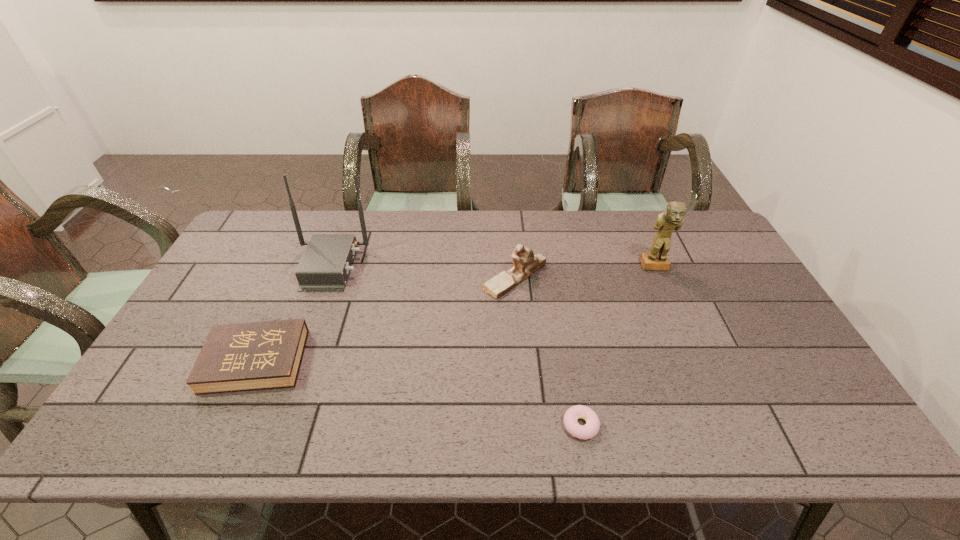
Image resolution: width=960 pixels, height=540 pixels. I want to click on vacant point located between the left figurine and the router, so click(422, 272).

You are a GUI agent. You are given a task and a screenshot of the screen. Output one action in this format:
    pyautogui.click(x=<x>, y=<y>)
    Task: Click on the vacant point located between the second shortest object and the right figurine
    The image size is (960, 540).
    Given the screenshot: What is the action you would take?
    pyautogui.click(x=455, y=314)

Where is `free space between the right figurine and the second nearest object`? free space between the right figurine and the second nearest object is located at coordinates (455, 314).

Identify the location of vacant point located between the hardback book and the rightmost object. The width and height of the screenshot is (960, 540). (455, 314).

Point out which object is positioned as the second nearest to the router. Please provide its 2D coordinates. Your answer should be formatted as a tuple, i.e. [(x, y)], where the tuple contains the x and y coordinates of a point satisfying the conditions above.

[(525, 262)]

Select which object is the third closest to the hardback book. Please provide its 2D coordinates. Your answer should be formatted as a tuple, i.e. [(x, y)], where the tuple contains the x and y coordinates of a point satisfying the conditions above.

[(592, 426)]

Locate an element on the screen. vacant point that satisfies the following two spatial constraints: 1. on the front-facing side of the left figurine; 2. on the front side of the second nearest object is located at coordinates (522, 361).

Locate an element on the screen. The height and width of the screenshot is (540, 960). free space that satisfies the following two spatial constraints: 1. on the back of the shortest object to connect cables; 2. on the right side of the router is located at coordinates (271, 425).

Locate an element on the screen. vacant position in the image that satisfies the following two spatial constraints: 1. on the front-facing side of the right figurine; 2. on the front-facing side of the shorter figurine is located at coordinates (660, 278).

Where is `vacant region that satisfies the following two spatial constraints: 1. on the front-facing side of the third shortest object; 2. on the right side of the nearest object`? The width and height of the screenshot is (960, 540). vacant region that satisfies the following two spatial constraints: 1. on the front-facing side of the third shortest object; 2. on the right side of the nearest object is located at coordinates (528, 425).